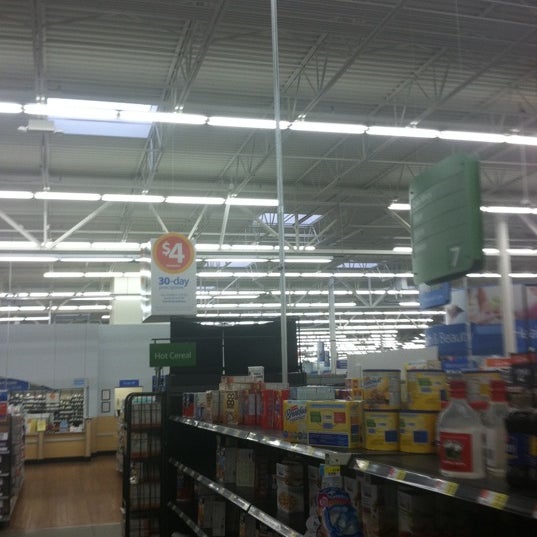
Identify the location of floor. (62, 497).